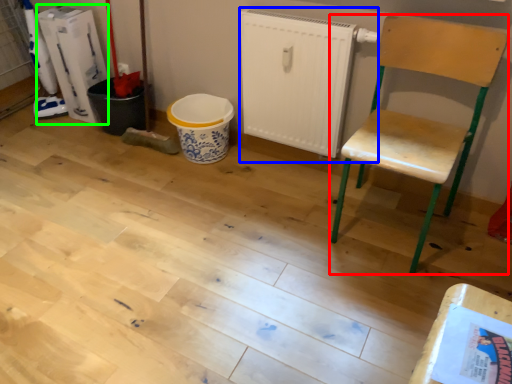
Question: Considering the real-world distances, which object is farthest from chair (highlighted by a red box)? radiator (highlighted by a blue box) or appliance (highlighted by a green box)?

Choices:
 (A) radiator
 (B) appliance

Answer: (B)